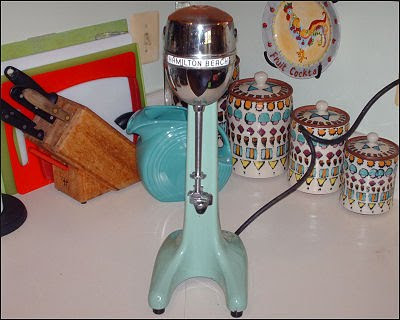
Identify the location of counter. The image size is (400, 320). (314, 243).